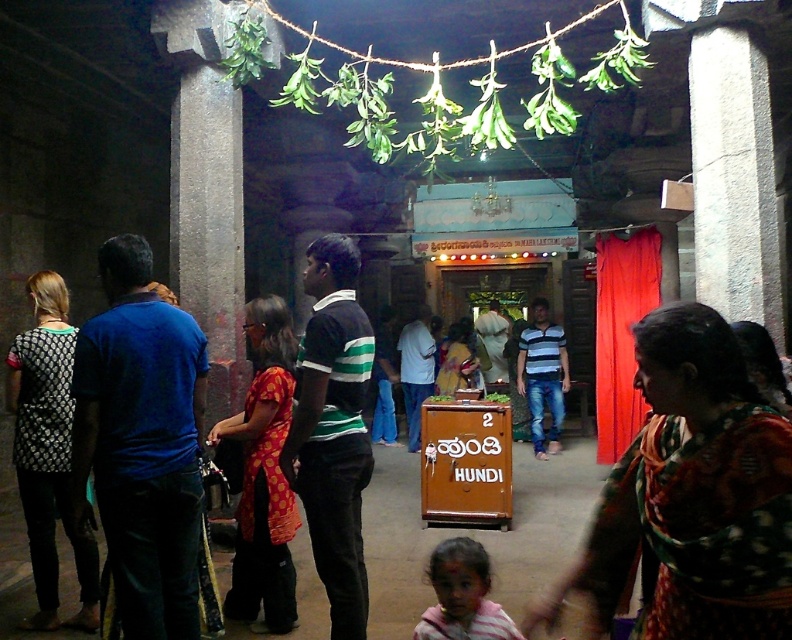
Is patterned fabric dress at left above polka dot fabric dress at center?

Indeed, patterned fabric dress at left is positioned over polka dot fabric dress at center.

Between patterned fabric dress at left and polka dot fabric dress at center, which one has more height?

patterned fabric dress at left

Is point (29, 465) in front of point (280, 509)?

No, it is behind (280, 509).

This screenshot has height=640, width=792. What are the coordinates of `patterned fabric dress at left` in the screenshot? It's located at (48, 451).

The width and height of the screenshot is (792, 640). Describe the element at coordinates (48, 451) in the screenshot. I see `patterned fabric dress at left` at that location.

How distant is patterned fabric dress at left from striped cotton hoodie at lower center?

patterned fabric dress at left and striped cotton hoodie at lower center are 6.20 feet apart.

Between point (37, 531) and point (454, 632), which one is positioned behind?

The point (37, 531) is more distant.

Find the location of a particular element. patterned fabric dress at left is located at coordinates (48, 451).

Who is lower down, polka dot fabric dress at center or striped cotton hoodie at lower center?

striped cotton hoodie at lower center

From the picture: Is polka dot fabric dress at center smaller than striped cotton hoodie at lower center?

No, polka dot fabric dress at center is not smaller than striped cotton hoodie at lower center.

Between point (261, 492) and point (486, 625), which one is positioned in front?

Point (486, 625) is in front.

I want to click on polka dot fabric dress at center, so click(x=263, y=476).